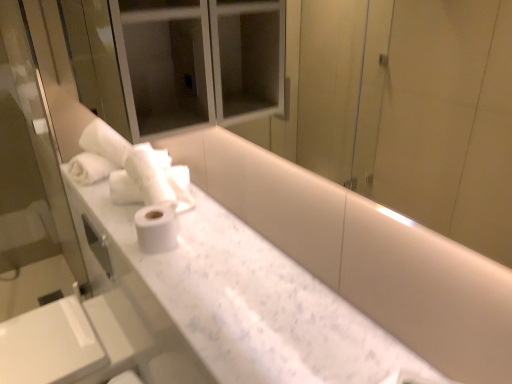
Where is `free spot in front of white matte toilet paper at center`? The height and width of the screenshot is (384, 512). free spot in front of white matte toilet paper at center is located at coordinates (162, 273).